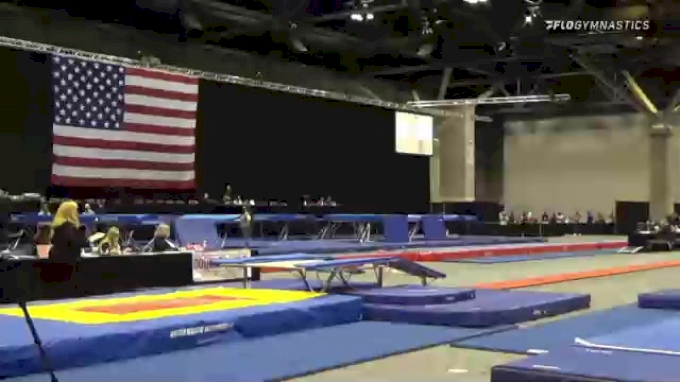
The width and height of the screenshot is (680, 382). What are the coordinates of `light green walls` in the screenshot? It's located at (600, 161).